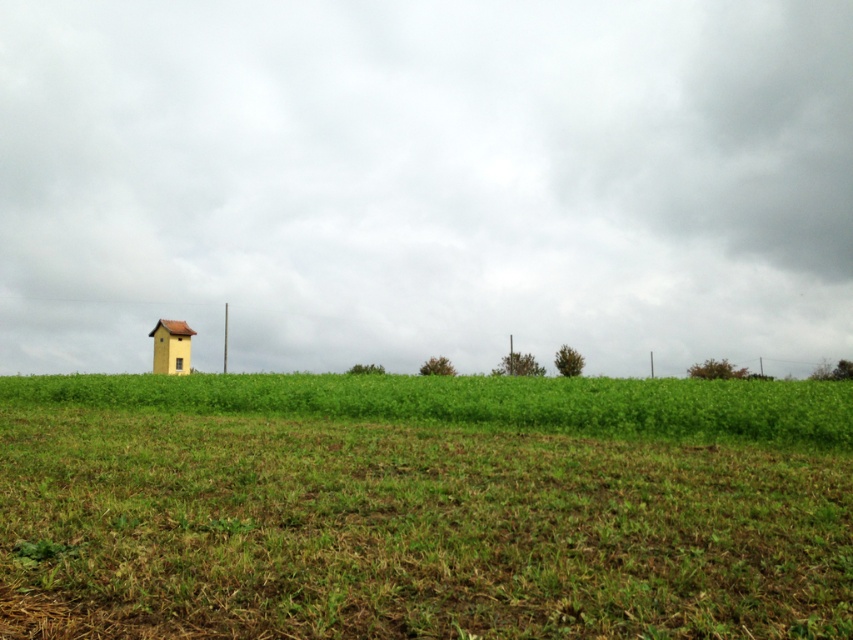
You are planning to place a new garden shed in this rural landscape. The shed requires a space that is wider than the matte yellow building at left and the yellow matte hut at left. Based on the scene, is there enough space between these two structures to accommodate the shed?

The matte yellow building at left might be wider than the yellow matte hut at left, but without knowing the exact width difference or the distance between them, it is unclear if there is sufficient space for the shed. Further measurements would be needed.

You are a farmer standing in the green grassy field at center and want to reach the matte yellow building at left. Which direction should you walk to get there?

The matte yellow building at left is positioned on the right side of green grassy field at center, so you should walk to the right to reach it.